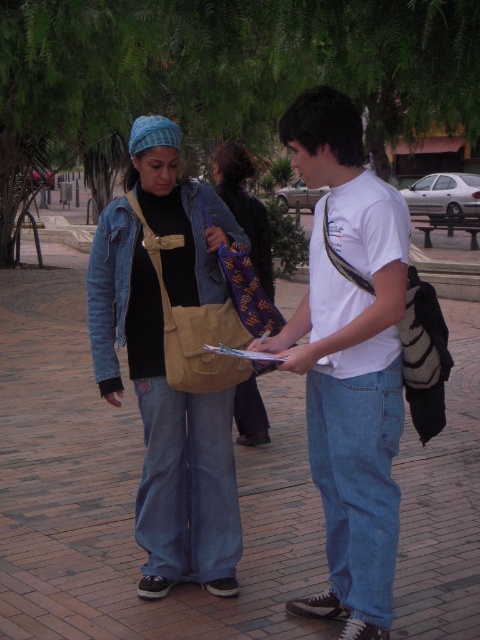
You are organizing a small event and need to determine which item has a greater width to use as a display stand. You have a matte beige bag at center and a denim jacket at center. Which one should you choose?

The matte beige bag at center has a larger width than the denim jacket at center, so it should be chosen as the display stand.

You are a photographer positioned behind the two people in the scene. You want to take a photo that clearly shows both the matte beige bag at center and the denim jacket at center. However, you notice that one object is blocking the view of the other. Which object is blocking the view of the other?

The matte beige bag at center is in front of the denim jacket at center, so the matte beige bag at center is blocking the view of the denim jacket at center.